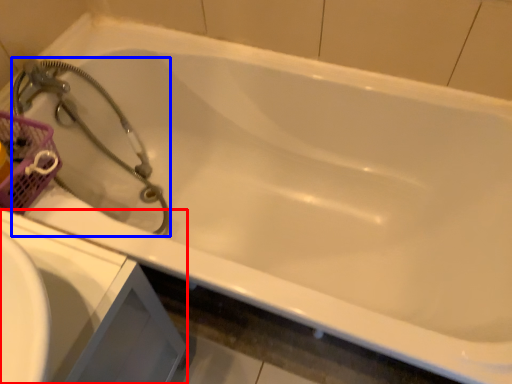
Question: Which point is closer to the camera, sink (highlighted by a red box) or garden hose (highlighted by a blue box)?

Choices:
 (A) sink
 (B) garden hose

Answer: (A)